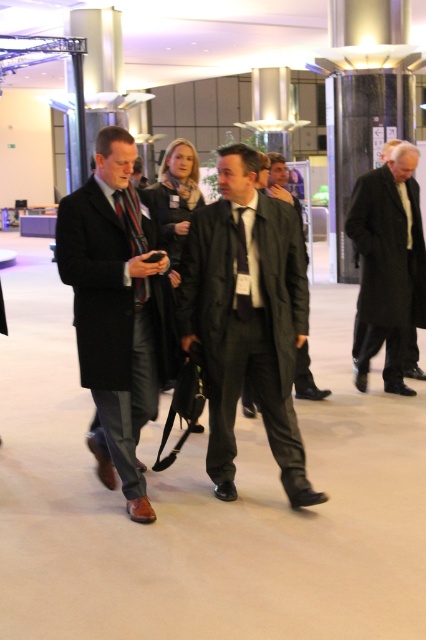
Question: Is matte black suit at center smaller than matte black coat at center?

Choices:
 (A) yes
 (B) no

Answer: (B)

Question: Which point appears farthest from the camera in this image?

Choices:
 (A) (238, 218)
 (B) (121, 288)
 (C) (377, 202)

Answer: (C)

Question: Can you confirm if matte black suit at center is positioned above black wool coat at right?

Choices:
 (A) yes
 (B) no

Answer: (B)

Question: Among these objects, which one is nearest to the camera?

Choices:
 (A) black wool coat at right
 (B) matte black suit at center
 (C) matte black coat at center

Answer: (C)

Question: Does black wool coat at right appear under black silk tie at center?

Choices:
 (A) yes
 (B) no

Answer: (B)

Question: Which of these objects is positioned closest to the matte black coat at center?

Choices:
 (A) black silk tie at center
 (B) matte black suit at center

Answer: (B)